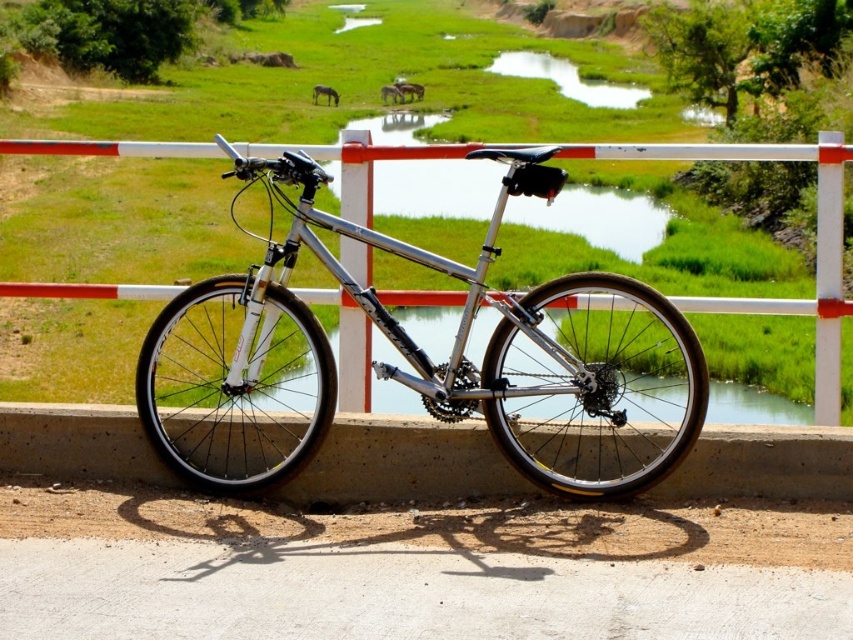
Looking at this image, you are planning to store the silver metallic mountain bike at center and the silver metallic bicycle at center in a narrow garage. Which one can fit through the narrow entrance more easily?

The silver metallic mountain bike at center has a lesser width compared to the silver metallic bicycle at center, so it can fit through the narrow entrance more easily.

You are standing in a park and see the silver metallic mountain bike at center and the silver metallic bicycle at center. Which one is closer to you?

The silver metallic mountain bike at center is closer because it is in front of the silver metallic bicycle at center.